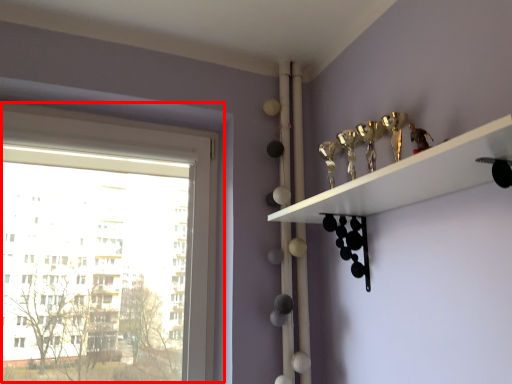
Question: From the image's perspective, where is window (annotated by the red box) located in relation to shelf in the image?

Choices:
 (A) above
 (B) below

Answer: (B)